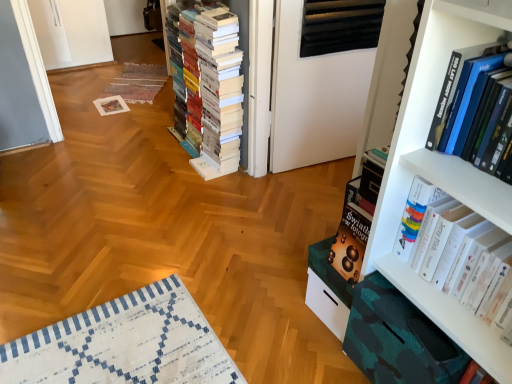
Question: Does white matte bookcase at right turn towards white glossy book at right, which is the second book in front-to-back order?

Choices:
 (A) no
 (B) yes

Answer: (A)

Question: Can you confirm if white matte bookcase at right is taller than white glossy book at right, which ranks as the 1th book in right-to-left order?

Choices:
 (A) no
 (B) yes

Answer: (B)

Question: Does white matte bookcase at right appear on the right side of white glossy book at right, which ranks as the 1th book in right-to-left order?

Choices:
 (A) yes
 (B) no

Answer: (B)

Question: From the image's perspective, does white matte bookcase at right appear lower than white glossy book at right, positioned as the third book in left-to-right order?

Choices:
 (A) yes
 (B) no

Answer: (B)

Question: Are white matte bookcase at right and white glossy book at right, which is the second book in front-to-back order, located far from each other?

Choices:
 (A) no
 (B) yes

Answer: (A)

Question: Is white matte bookcase at right smaller than white glossy book at right, positioned as the third book in left-to-right order?

Choices:
 (A) no
 (B) yes

Answer: (A)

Question: Can you confirm if hardcover book at upper right, the second book in the right-to-left sequence, is thinner than white matte bookcase at right?

Choices:
 (A) yes
 (B) no

Answer: (B)

Question: From the image's perspective, would you say hardcover book at upper right, the 2th book positioned from the left, is shown under white matte bookcase at right?

Choices:
 (A) no
 (B) yes

Answer: (B)

Question: Considering the relative sizes of hardcover book at upper right, the third book in the back-to-front sequence, and white matte bookcase at right in the image provided, is hardcover book at upper right, the third book in the back-to-front sequence, taller than white matte bookcase at right?

Choices:
 (A) no
 (B) yes

Answer: (A)

Question: Does hardcover book at upper right, acting as the 1th book starting from the front, turn towards white matte bookcase at right?

Choices:
 (A) no
 (B) yes

Answer: (A)

Question: Considering the relative positions of hardcover book at upper right, the 2th book positioned from the left, and white matte bookcase at right in the image provided, is hardcover book at upper right, the 2th book positioned from the left, to the left of white matte bookcase at right from the viewer's perspective?

Choices:
 (A) yes
 (B) no

Answer: (B)

Question: Is hardcover book at upper right, the third book in the back-to-front sequence, not within white matte bookcase at right?

Choices:
 (A) yes
 (B) no

Answer: (A)

Question: Does white glossy book at right, which is the second book in front-to-back order, have a lesser height compared to white matte book at center, the 3th book in the right-to-left sequence?

Choices:
 (A) no
 (B) yes

Answer: (B)